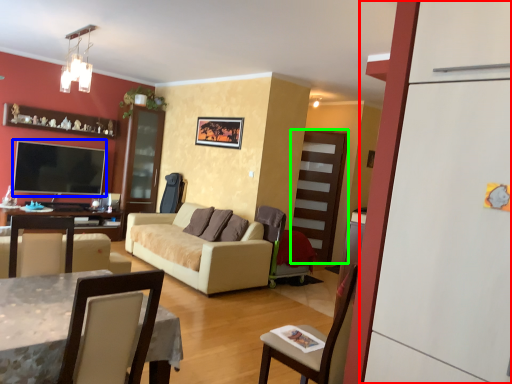
Question: Which is nearer to the fridge (highlighted by a red box)? television (highlighted by a blue box) or glass door (highlighted by a green box).

Choices:
 (A) television
 (B) glass door

Answer: (B)